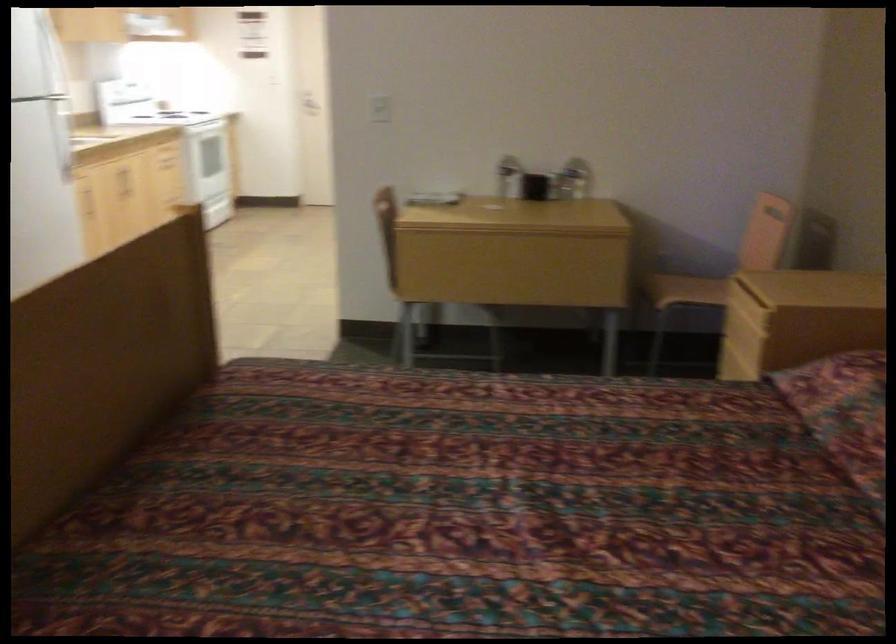
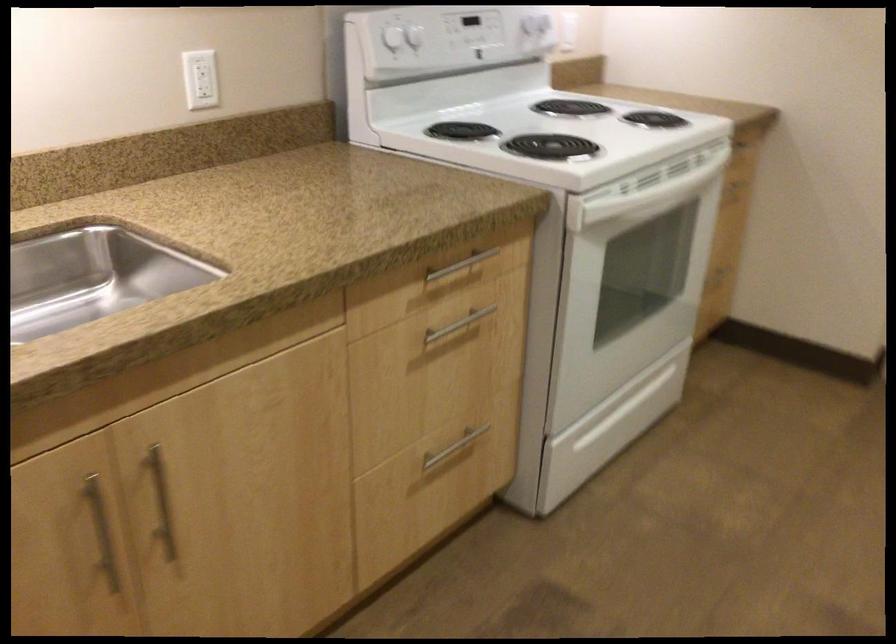
The point at (73, 93) is marked in the first image. Where is the corresponding point in the second image?

(200, 79)